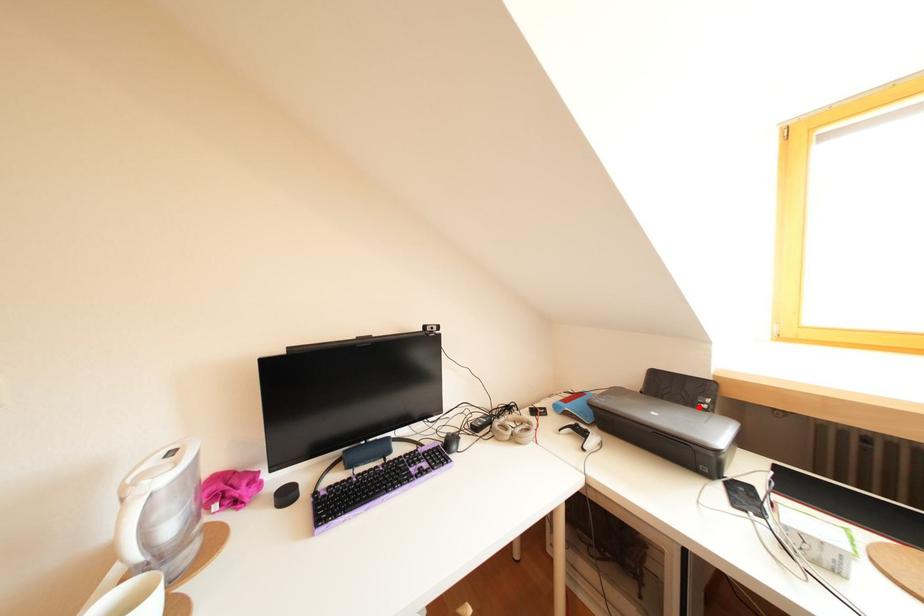
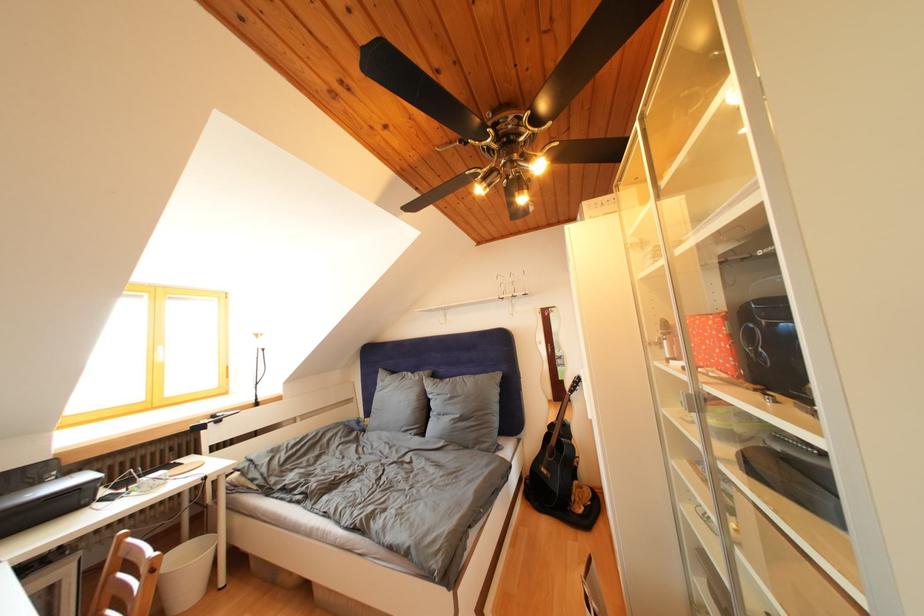
Where in the second image is the point corresponding to the highlighted location from the first image?

(44, 488)